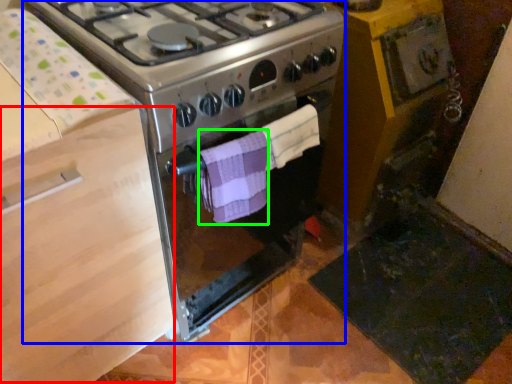
Question: Which object is the farthest from drawer (highlighted by a red box)? Choose among these: gas stove (highlighted by a blue box) or towel/napkin (highlighted by a green box).

Choices:
 (A) gas stove
 (B) towel/napkin

Answer: (B)